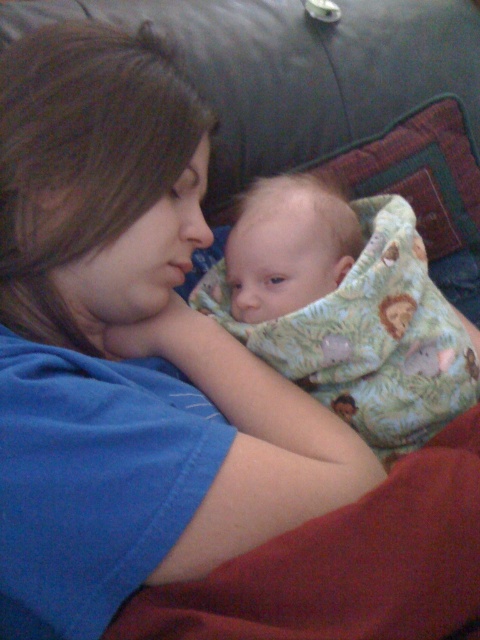
You are a photographer setting up a shoot in the living room. You have a soft green fabric baby at center and a soft red blanket at lower right. You need to position a small prop that must be placed next to the smaller object. Which object should you place the prop next to?

The soft red blanket at lower right is smaller in size than the soft green fabric baby at center, so you should place the prop next to the soft red blanket at lower right.

You are a photographer adjusting your camera settings to capture the best possible image. The camera is set to focus on the point at coordinates point (202, 285). Given that the focus point is 35.99 inches away from the camera, is this distance within the recommended focusing range of 30 to 40 inches for optimal clarity?

Yes, the point (202, 285) is 35.99 inches from the camera, which falls within the recommended 30 to 40 inches range for optimal clarity.